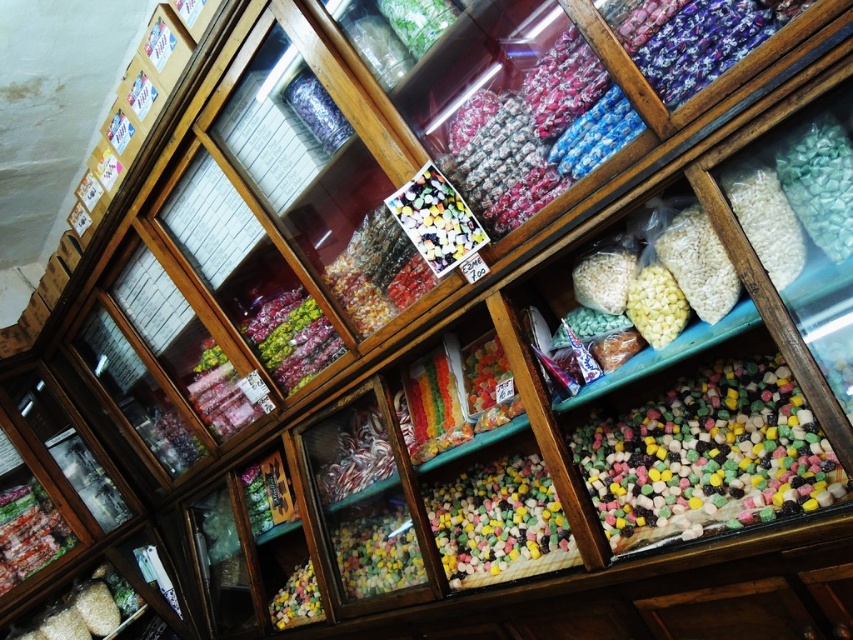
Question: Is multicolored glossy candy at center positioned behind white matte rice at right?

Choices:
 (A) no
 (B) yes

Answer: (B)

Question: Can you confirm if multicolored sugar at center is bigger than translucent plastic candy at lower center?

Choices:
 (A) no
 (B) yes

Answer: (B)

Question: Does multicolored glossy candy at center have a lesser width compared to translucent plastic candy at lower center?

Choices:
 (A) no
 (B) yes

Answer: (A)

Question: Which object is farther from the camera taking this photo?

Choices:
 (A) multicolored glossy candy at center
 (B) glossy plastic candy at center
 (C) green translucent beads at upper right
 (D) white matte rice at right

Answer: (B)

Question: Which is nearer to the translucent plastic candy at lower center?

Choices:
 (A) glossy plastic candy at center
 (B) multicolored rubber at center

Answer: (A)

Question: Which point appears closest to the camera in this image?

Choices:
 (A) (339, 490)
 (B) (492, 504)

Answer: (B)